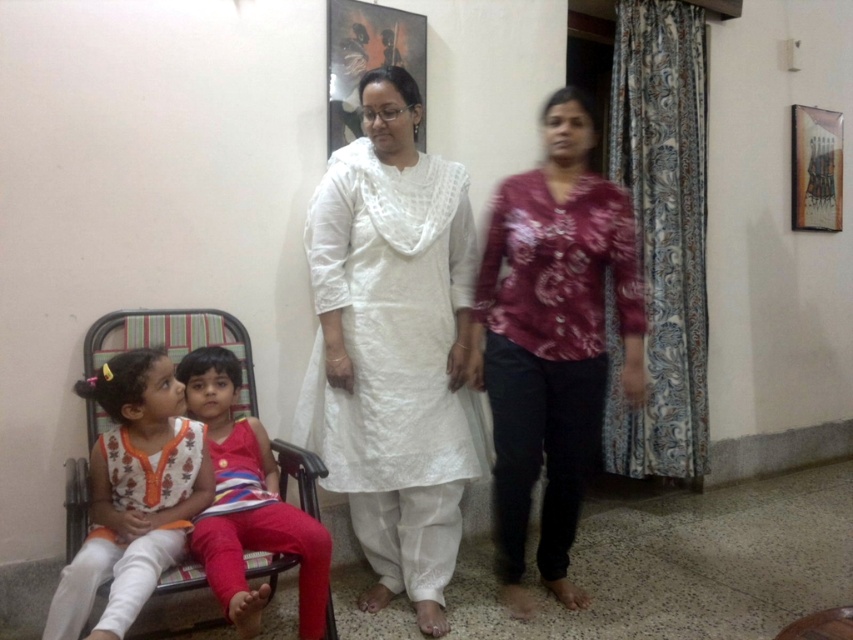
Question: Is white cotton kurta at center wider than metallic fabric armchair at lower left?

Choices:
 (A) no
 (B) yes

Answer: (A)

Question: Which point is farther to the camera?

Choices:
 (A) (218, 387)
 (B) (434, 225)
 (C) (247, 349)
 (D) (206, 490)

Answer: (C)

Question: Which point is closer to the camera taking this photo?

Choices:
 (A) (207, 525)
 (B) (556, 269)
 (C) (373, 260)

Answer: (A)

Question: Does white cotton dress at left have a lesser width compared to metallic fabric armchair at lower left?

Choices:
 (A) yes
 (B) no

Answer: (A)

Question: Does white cotton kurta at center have a lesser width compared to white cotton dress at left?

Choices:
 (A) yes
 (B) no

Answer: (B)

Question: Which is nearer to the metallic fabric armchair at lower left?

Choices:
 (A) striped fabric tank top at center
 (B) white cotton dress at left

Answer: (A)